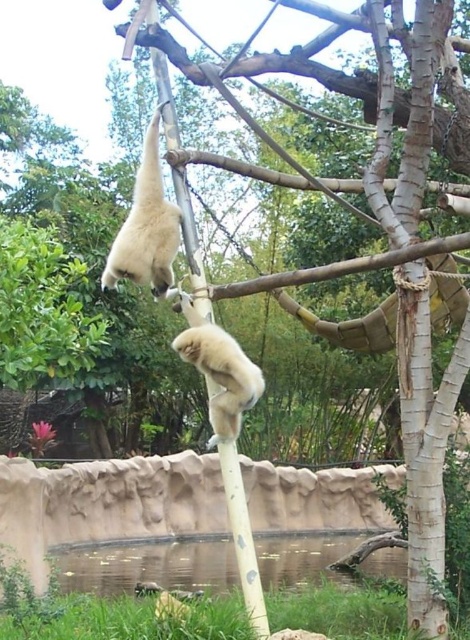
You are a zookeeper who needs to feed the white fur monkey at upper center. You have a food tray that can extend up to 1.5 meters. Can you reach the monkey using the tray from the white matte pole at center?

The white matte pole at center is 1.49 meters from the white fur monkey at upper center. Since the food tray can extend up to 1.5 meters, you can reach the monkey by extending the tray from the white matte pole at center.

Looking at this image, you are a zookeeper trying to locate the white fur monkey at upper center. According to the coordinates provided, where would you find it in the image?

The white fur monkey at upper center is located at coordinates point (147,227).